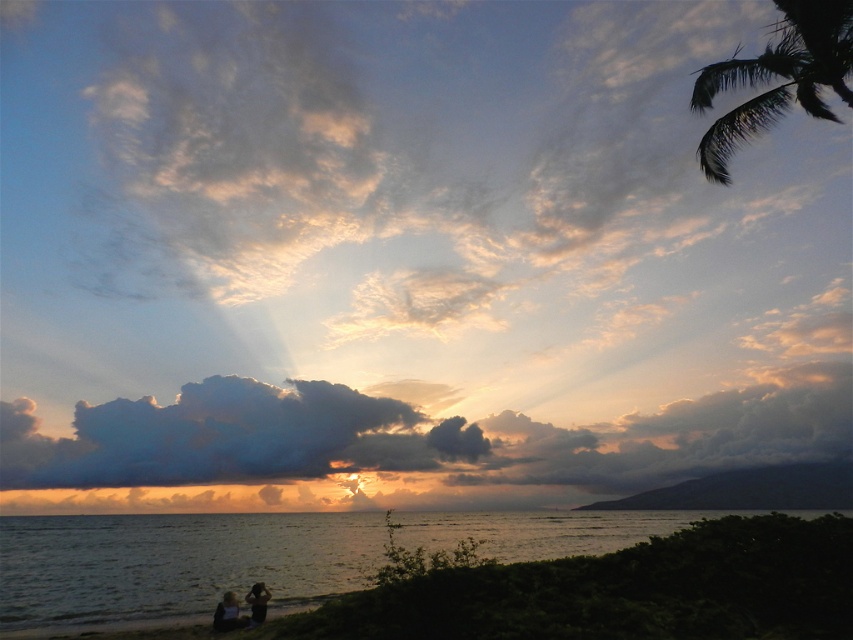
Is cloudy sky at center further to camera compared to dark green leafy palm tree at upper right?

Yes, it is behind dark green leafy palm tree at upper right.

Is cloudy sky at center wider than dark green leafy palm tree at upper right?

Yes.

Image resolution: width=853 pixels, height=640 pixels. What are the coordinates of `cloudy sky at center` in the screenshot? It's located at (228, 436).

The height and width of the screenshot is (640, 853). I want to click on cloudy sky at center, so click(228, 436).

Does silvery metallic couple at lower center lie in front of smooth skin person at lower left?

No, it is behind smooth skin person at lower left.

Looking at this image, does silvery metallic couple at lower center appear on the right side of smooth skin person at lower left?

Indeed, silvery metallic couple at lower center is positioned on the right side of smooth skin person at lower left.

This screenshot has height=640, width=853. I want to click on silvery metallic couple at lower center, so click(x=238, y=609).

Is dark green leafy palm tree at upper right taller than smooth skin person at lower left?

Indeed, dark green leafy palm tree at upper right has a greater height compared to smooth skin person at lower left.

Between dark green leafy palm tree at upper right and smooth skin person at lower left, which one has more height?

dark green leafy palm tree at upper right is taller.

Who is more distant from viewer, (x=769, y=45) or (x=218, y=616)?

Positioned behind is point (x=769, y=45).

Where is `dark green leafy palm tree at upper right`? dark green leafy palm tree at upper right is located at coordinates (778, 77).